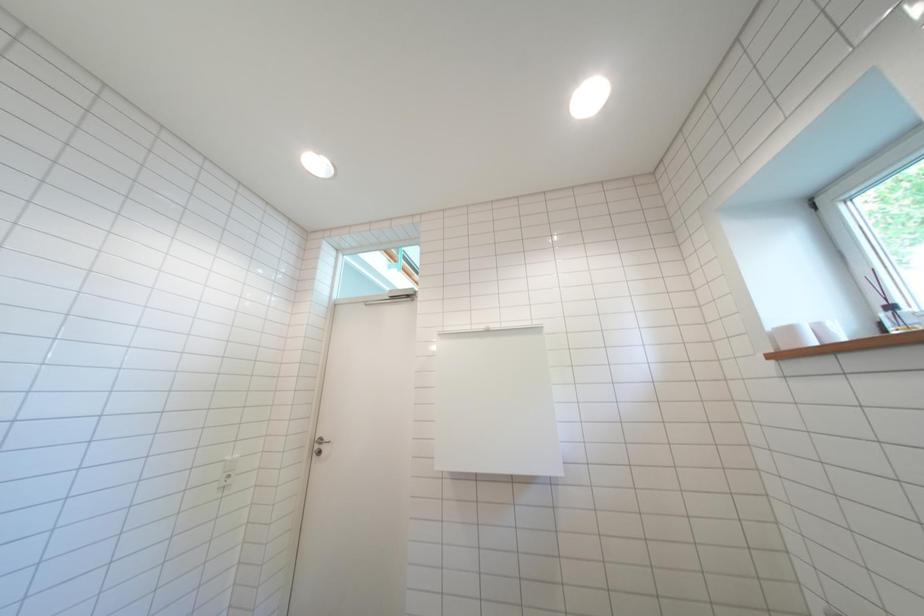
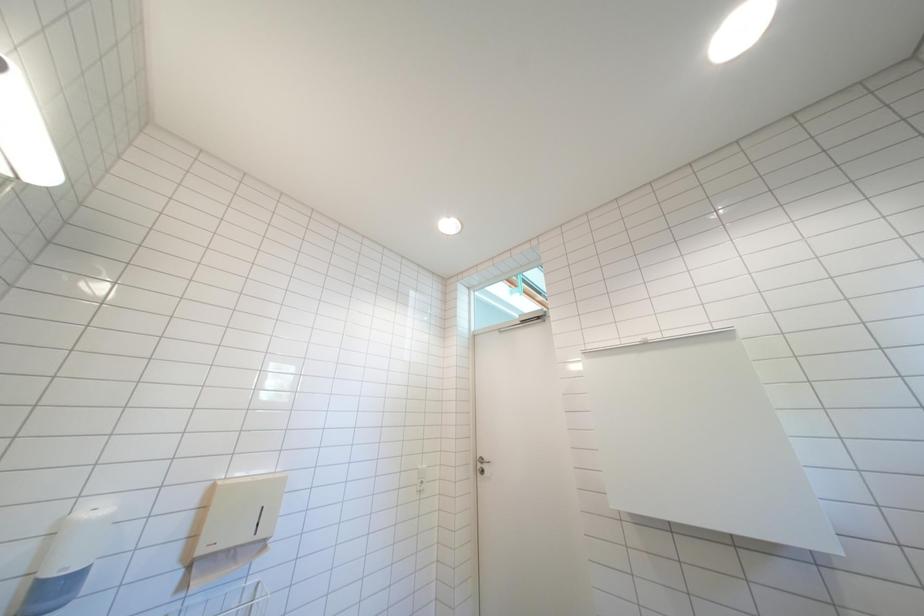
In a continuous first-person perspective shot, in which direction is the camera moving?

The cameraman moved toward left, backward.